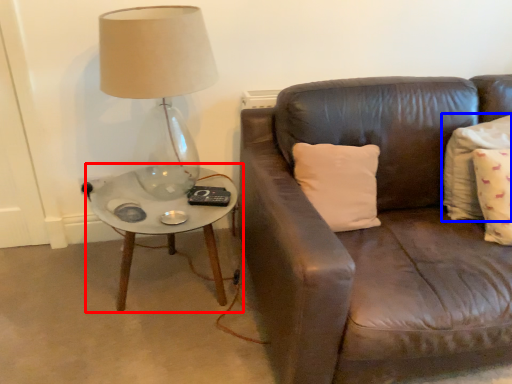
Question: Among these objects, which one is farthest to the camera, coffee table (highlighted by a red box) or pillow (highlighted by a blue box)?

Choices:
 (A) coffee table
 (B) pillow

Answer: (A)